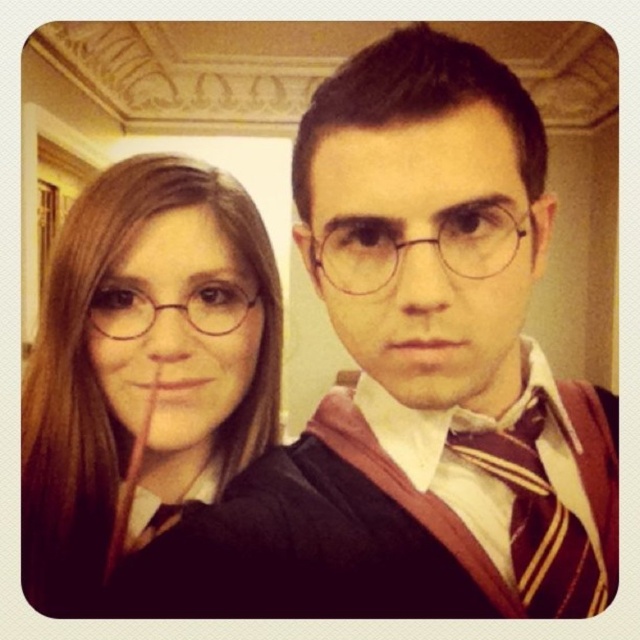
Which is in front, point (374, 269) or point (122, 310)?

Point (374, 269) is more forward.

Who is more distant from viewer, (499, 246) or (93, 304)?

Point (93, 304)

You are a GUI agent. You are given a task and a screenshot of the screen. Output one action in this format:
    pyautogui.click(x=<x>, y=<y>)
    Task: Click on the clear plastic glasses at center
    This screenshot has width=640, height=640.
    Given the screenshot: What is the action you would take?
    coord(417,243)

Does point (56, 337) come closer to viewer compared to point (611, 492)?

No.

Which is in front, point (218, 189) or point (524, 419)?

Point (524, 419)

This screenshot has height=640, width=640. I want to click on matte black robe at left, so click(144, 365).

Between point (602, 496) and point (451, 243), which one is positioned behind?

The point (602, 496) is behind.

From the picture: Between striped wool tie at center and clear plastic glasses at center, which one has less height?

clear plastic glasses at center

The width and height of the screenshot is (640, 640). Identify the location of striped wool tie at center. (538, 522).